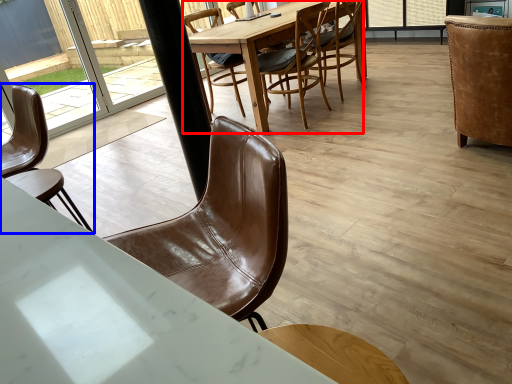
Question: Which point is closer to the camera, round table (highlighted by a red box) or chair (highlighted by a blue box)?

Choices:
 (A) round table
 (B) chair

Answer: (B)